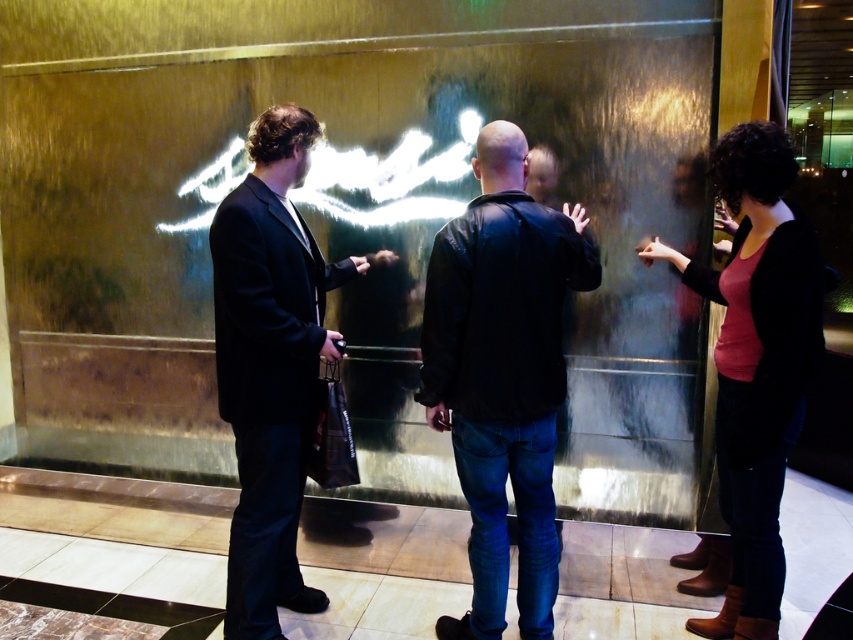
In the scene shown: Is black leather jacket at center smaller than matte black sweater at right?

Yes, black leather jacket at center is smaller than matte black sweater at right.

This screenshot has height=640, width=853. Identify the location of black leather jacket at center. (502, 374).

Who is positioned more to the left, black leather jacket at center or matte black suit at left?

matte black suit at left

Is black leather jacket at center shorter than matte black suit at left?

Correct, black leather jacket at center is not as tall as matte black suit at left.

Locate an element on the screen. The height and width of the screenshot is (640, 853). black leather jacket at center is located at coordinates (502, 374).

Between matte black suit at left and matte black sweater at right, which one is positioned lower?

matte black sweater at right

Who is more distant from viewer, (300, 365) or (770, 145)?

Positioned behind is point (300, 365).

Image resolution: width=853 pixels, height=640 pixels. Find the location of `matte black suit at left`. matte black suit at left is located at coordinates (271, 364).